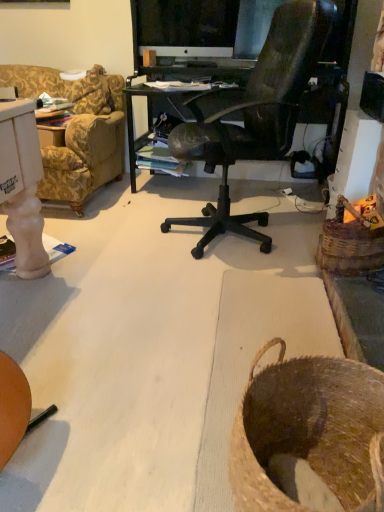
Find the location of a particular element. The height and width of the screenshot is (512, 384). vacant space to the left of brown woven basket at lower right, acting as the 2th basket starting from the top is located at coordinates (150, 453).